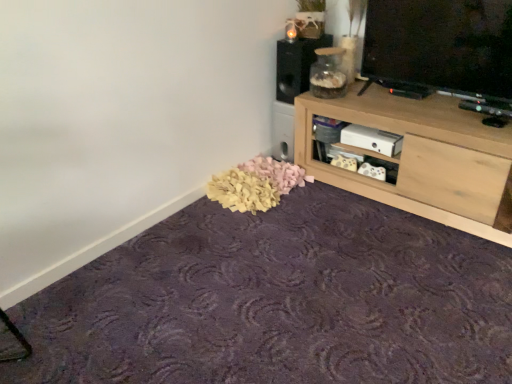
Question: Would you say black matte speaker at upper center is inside or outside transparent glass jar at upper right?

Choices:
 (A) outside
 (B) inside

Answer: (A)

Question: Considering the positions of black matte speaker at upper center and transparent glass jar at upper right in the image, is black matte speaker at upper center wider or thinner than transparent glass jar at upper right?

Choices:
 (A) wide
 (B) thin

Answer: (A)

Question: Considering the real-world distances, which object is closest to the purple textured carpet at lower center?

Choices:
 (A) black matte speaker at upper center
 (B) transparent glass jar at upper right
 (C) light wood shelf at upper right

Answer: (C)

Question: Which object is positioned closest to the purple textured carpet at lower center?

Choices:
 (A) black matte speaker at upper center
 (B) transparent glass jar at upper right
 (C) light wood shelf at upper right

Answer: (C)